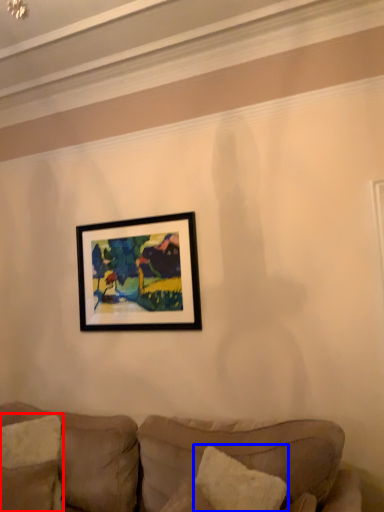
Question: Which of the following is the closest to the observer, pillow (highlighted by a red box) or pillow (highlighted by a blue box)?

Choices:
 (A) pillow
 (B) pillow

Answer: (B)